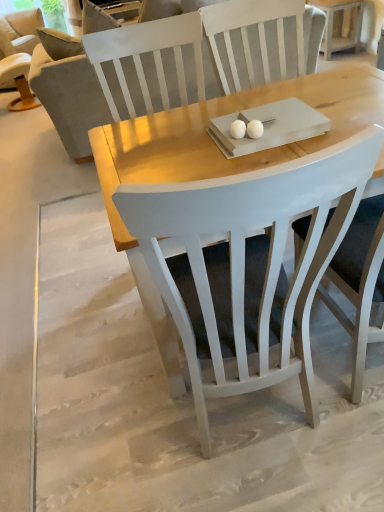
This screenshot has height=512, width=384. Identify the location of vacant space underneath white wood chair at center, acting as the 2th chair starting from the top (from a real-world perspective). (253, 422).